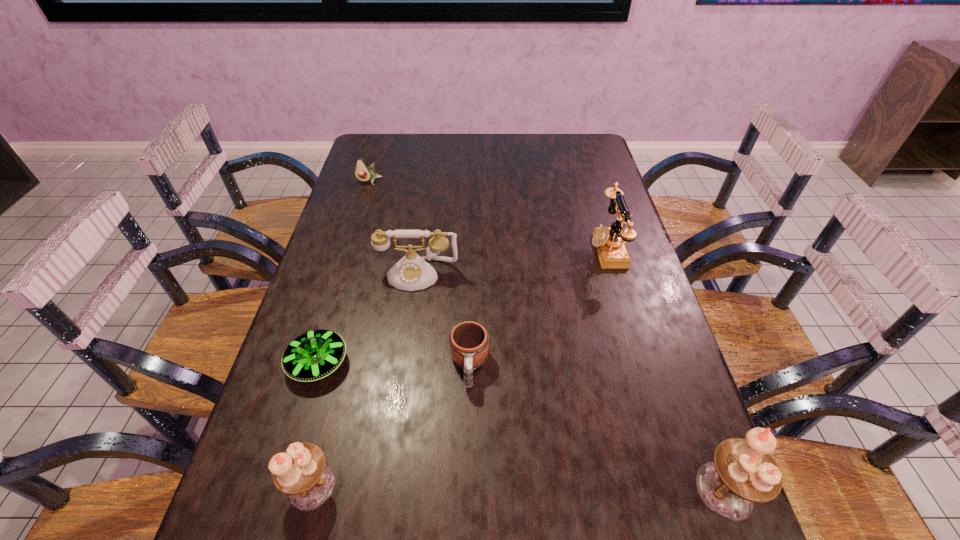
The height and width of the screenshot is (540, 960). What are the coordinates of `vacant space that is in between the avocado and the right candle holder` in the screenshot? It's located at (547, 336).

Locate an element on the screen. Image resolution: width=960 pixels, height=540 pixels. free space between the saucer and the right candle holder is located at coordinates (521, 427).

Image resolution: width=960 pixels, height=540 pixels. What are the coordinates of `free space between the shorter candle holder and the right candle holder` in the screenshot? It's located at (518, 488).

Locate an element on the screen. The height and width of the screenshot is (540, 960). unoccupied position between the shortest object and the tallest object is located at coordinates [x=521, y=427].

You are a GUI agent. You are given a task and a screenshot of the screen. Output one action in this format:
    pyautogui.click(x=<x>, y=<y>)
    Task: Click on the unoccupied area between the left candle holder and the shortest object
    
    Given the screenshot: What is the action you would take?
    tap(315, 424)

What are the coordinates of `free space that is in between the mug and the left telephone` in the screenshot? It's located at (444, 320).

You are a GUI agent. You are given a task and a screenshot of the screen. Output one action in this format:
    pyautogui.click(x=<x>, y=<y>)
    Task: Click on the free spot between the farthest object and the right telephone
    
    Given the screenshot: What is the action you would take?
    pyautogui.click(x=489, y=215)

The image size is (960, 540). I want to click on empty space that is in between the shortest object and the left candle holder, so click(315, 424).

What are the coordinates of `unoccupied position between the farthest object and the saucer` in the screenshot? It's located at (344, 272).

Identify which object is located as the third nearest to the farthest object. Please provide its 2D coordinates. Your answer should be formatted as a tuple, i.e. [(x, y)], where the tuple contains the x and y coordinates of a point satisfying the conditions above.

[(609, 241)]